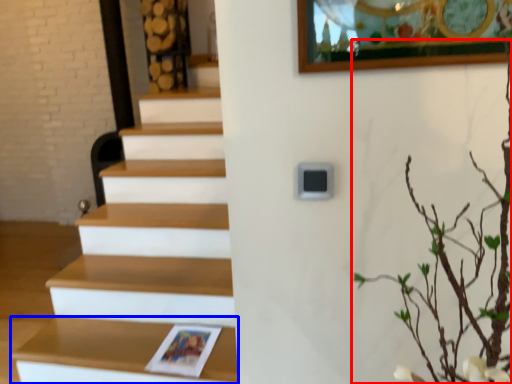
Question: Which point is further to the camera, tree (highlighted by a red box) or shelf (highlighted by a blue box)?

Choices:
 (A) tree
 (B) shelf

Answer: (B)